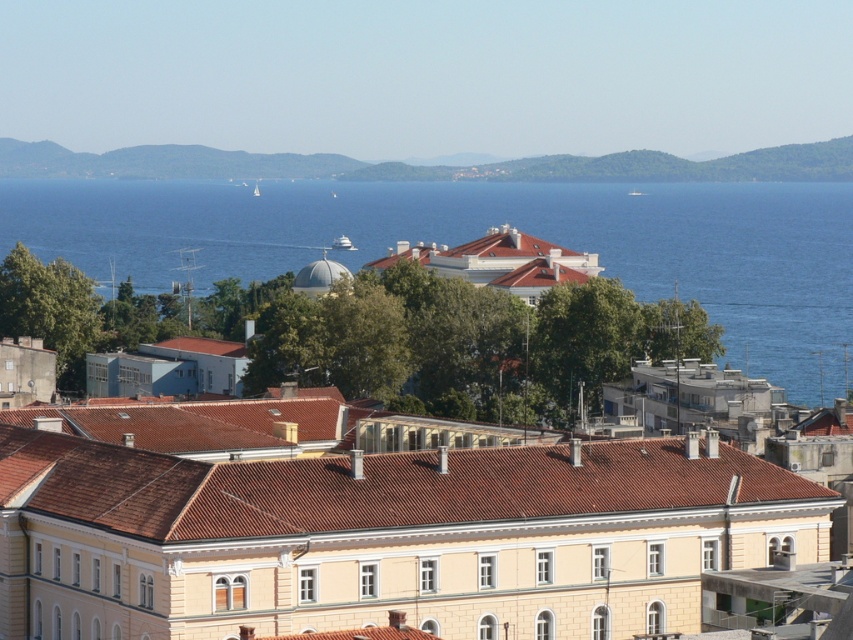
You are a tourist standing in the coastal town and want to take a photo that includes both the beige stone building at center and the blue water at center. Which object should you position closer to the foreground to ensure both are in focus?

The beige stone building at center is shorter than the blue water at center, so positioning the beige stone building at center closer to the foreground will help keep both objects in focus since it is closer to the camera.

You are standing at the point labeled point (376, 529) in the coastal town scene. What building are you facing?

You are facing the beige stone building at center, as point (376, 529) corresponds to that building.